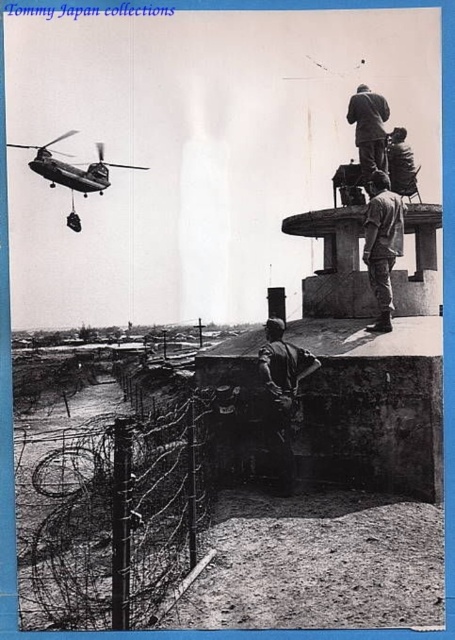
Is camouflage fabric soldier at center smaller than smooth gray uniform at upper center?

Correct, camouflage fabric soldier at center occupies less space than smooth gray uniform at upper center.

You are a GUI agent. You are given a task and a screenshot of the screen. Output one action in this format:
    pyautogui.click(x=<x>, y=<y>)
    Task: Click on the camouflage fabric soldier at center
    The width and height of the screenshot is (455, 640).
    Given the screenshot: What is the action you would take?
    pyautogui.click(x=282, y=394)

Can you confirm if metallic gray helicopter at upper left is smaller than smooth gray uniform at upper center?

Indeed, metallic gray helicopter at upper left has a smaller size compared to smooth gray uniform at upper center.

Based on the photo, does metallic gray helicopter at upper left appear on the right side of smooth gray uniform at upper center?

Incorrect, metallic gray helicopter at upper left is not on the right side of smooth gray uniform at upper center.

Is point (107, 173) positioned in front of point (364, 152)?

That is False.

I want to click on metallic gray helicopter at upper left, so click(72, 172).

What do you see at coordinates (383, 244) in the screenshot?
I see `dark gray uniform at center` at bounding box center [383, 244].

Identify the location of dark gray uniform at center. The height and width of the screenshot is (640, 455). (383, 244).